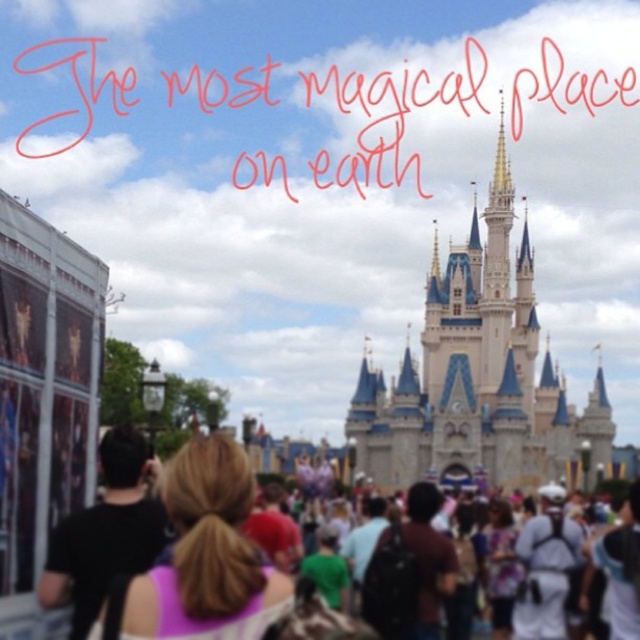
Based on the photo, you are standing in the theme park and see the white stone castle at center and the blonde hair at center. Which object is positioned higher from the ground?

The white stone castle at center is positioned higher from the ground than the blonde hair at center since it is located above it.